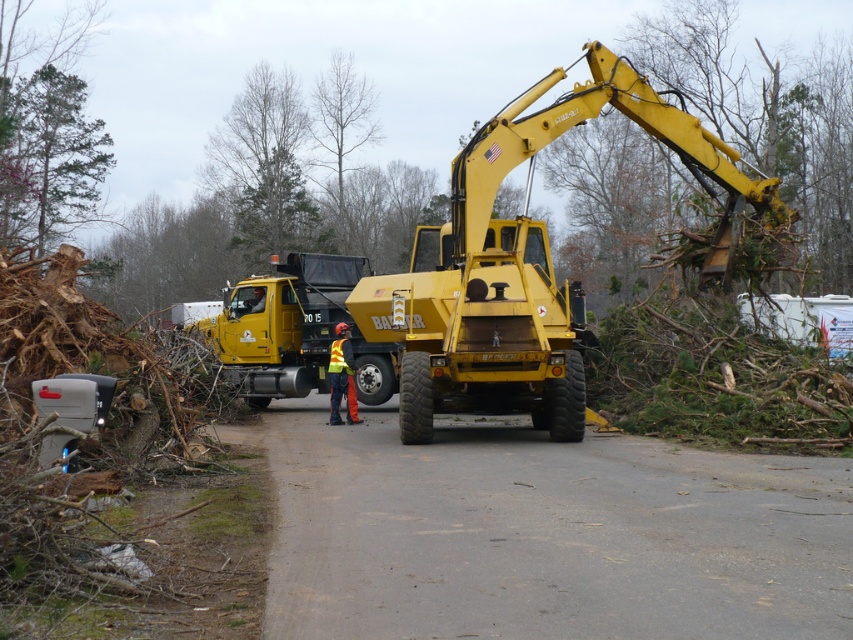
Does green leafy tree at upper center have a larger size compared to reflective yellow vest at center?

Yes, green leafy tree at upper center is bigger than reflective yellow vest at center.

Identify the location of green leafy tree at upper center. This screenshot has width=853, height=640. (264, 166).

Who is more distant from viewer, (228,156) or (347,397)?

Positioned behind is point (228,156).

Identify the location of green leafy tree at upper center. (264, 166).

Is green leafy tree at upper left behind reflective yellow vest at center?

Yes, it is.

Which is more to the right, green leafy tree at upper left or reflective yellow vest at center?

reflective yellow vest at center

Locate an element on the screen. Image resolution: width=853 pixels, height=640 pixels. green leafy tree at upper left is located at coordinates (48, 157).

Which is in front, point (24, 205) or point (360, 96)?

Point (24, 205) is in front.

Who is taller, green leafy tree at upper left or bare wood tree at upper center?

Standing taller between the two is bare wood tree at upper center.

Is point (48, 140) farther from camera compared to point (326, 120)?

No.

The width and height of the screenshot is (853, 640). I want to click on green leafy tree at upper left, so click(48, 157).